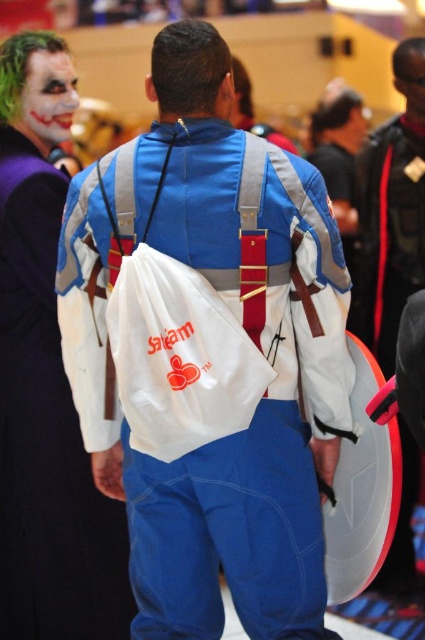
What object is located at the coordinates point (390, 228) in the image?

The point (390, 228) corresponds to the white fabric shield at right.